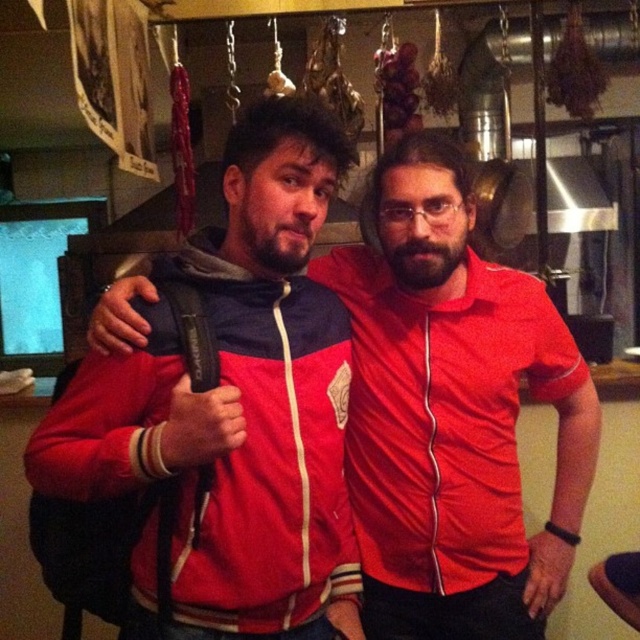
Which is above, red/white zip-up jacket at center or matte red shirt at center?

matte red shirt at center is above.

Image resolution: width=640 pixels, height=640 pixels. I want to click on red/white zip-up jacket at center, so click(268, 456).

The image size is (640, 640). Identify the location of red/white zip-up jacket at center. (268, 456).

Does red matte jacket at center have a larger size compared to matte red shirt at center?

Correct, red matte jacket at center is larger in size than matte red shirt at center.

Which of these two, red matte jacket at center or matte red shirt at center, stands taller?

red matte jacket at center

Is point (522, 589) farther from camera compared to point (486, 340)?

Yes.

Locate an element on the screen. The image size is (640, 640). red matte jacket at center is located at coordinates (452, 413).

Which is more to the left, red matte jacket at center or red/white zip-up jacket at center?

From the viewer's perspective, red/white zip-up jacket at center appears more on the left side.

Is point (516, 417) closer to camera compared to point (237, 532)?

No, (516, 417) is further to viewer.

Where is `red matte jacket at center`? Image resolution: width=640 pixels, height=640 pixels. red matte jacket at center is located at coordinates (452, 413).